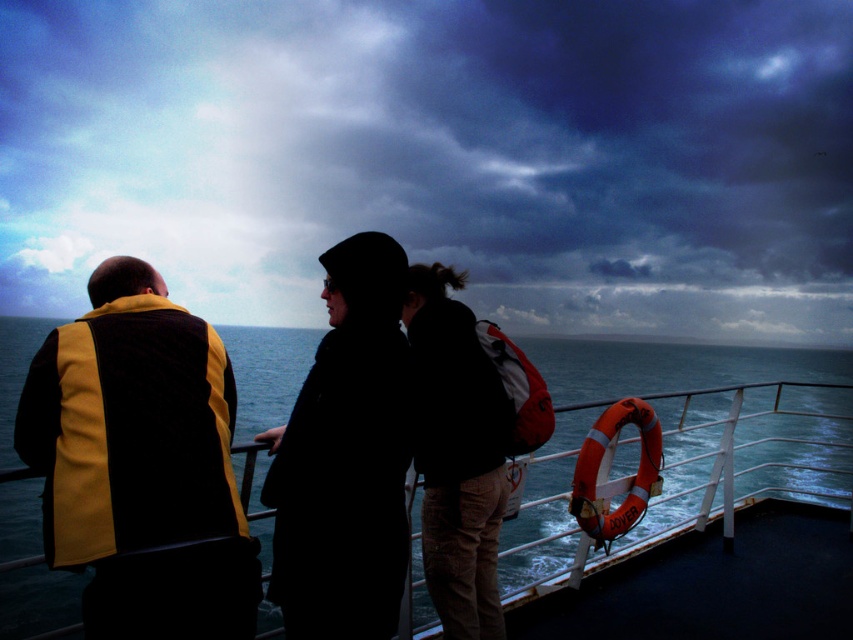
You are standing on the ferry deck and want to reach the point marked at coordinates point (242, 356). If your walking speed is 1.5 meters per second, how many seconds will it take you to reach that point?

The distance between you and point (242, 356) is 43.16 meters. At a speed of 1.5 meters per second, it will take approximately 28.77 seconds to reach the point.

You are a safety inspector on the ferry deck. You need to ensure that the yellow and black fabric life vest at left and the rubber lifebuoy at right are visible to passengers. Based on their heights, which one might be harder to see from a distance?

The yellow and black fabric life vest at left has a lesser height compared to the rubber lifebuoy at right, so it might be harder to see from a distance.